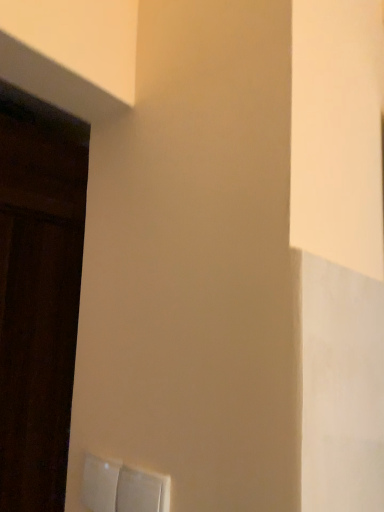
Identify the location of white plastic light switch at lower left. (123, 487).

What do you see at coordinates (123, 487) in the screenshot? The width and height of the screenshot is (384, 512). I see `white plastic light switch at lower left` at bounding box center [123, 487].

This screenshot has height=512, width=384. I want to click on white plastic light switch at lower left, so click(x=123, y=487).